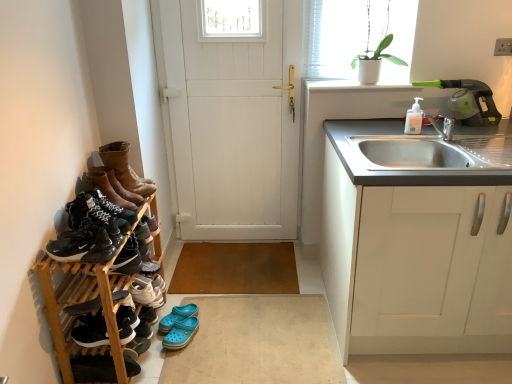
Find the location of `free location in front of blue rubber clogs at lower center, the ninth footwear in the top-to-bottom sequence`. free location in front of blue rubber clogs at lower center, the ninth footwear in the top-to-bottom sequence is located at coordinates (187, 355).